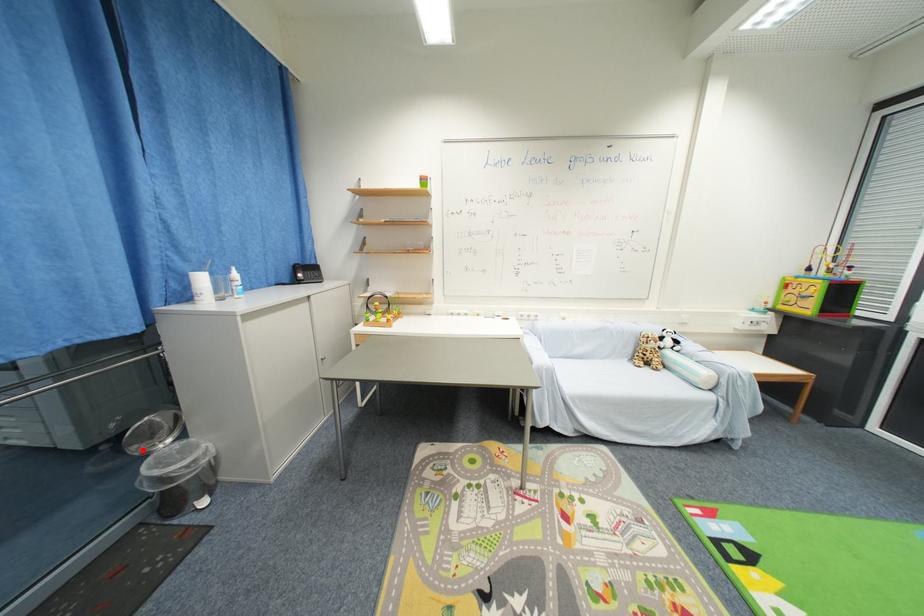
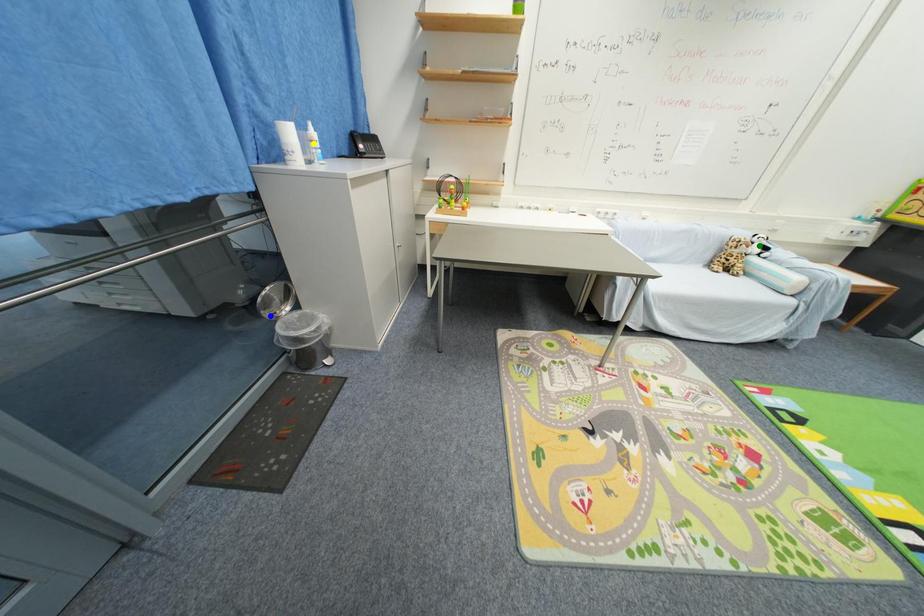
Question: I am providing you with two images of the same scene from different viewpoints. A red point is marked on the first image. You are given multiple points on the second image. Which mark in image 2 goes with the point in image 1?

Choices:
 (A) yellow point
 (B) green point
 (C) blue point

Answer: (C)